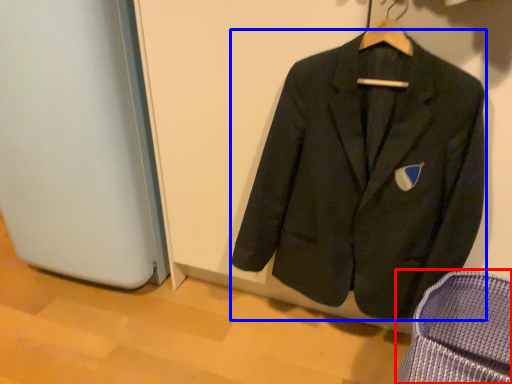
Question: Which of the following is the closest to the observer, armchair (highlighted by a red box) or suit (highlighted by a blue box)?

Choices:
 (A) armchair
 (B) suit

Answer: (A)